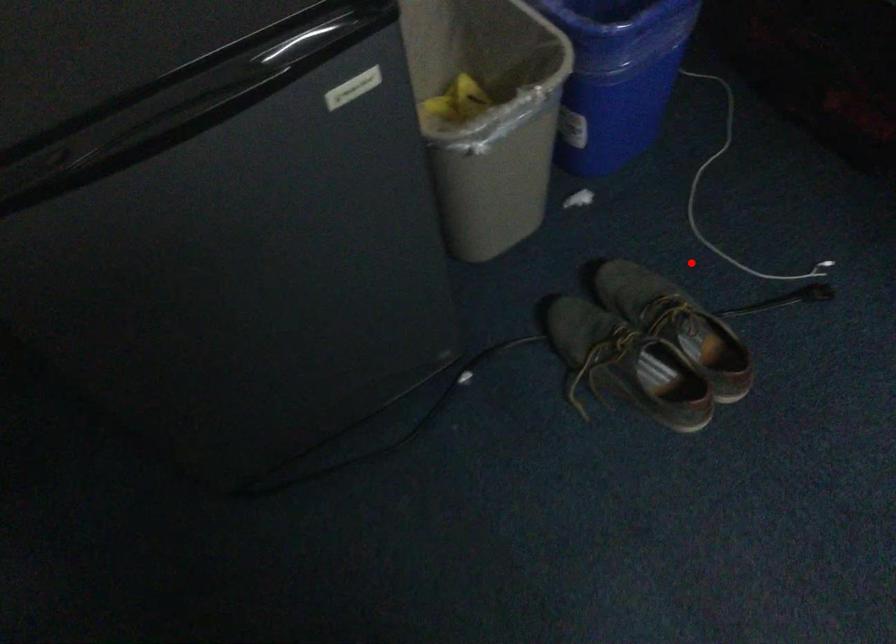
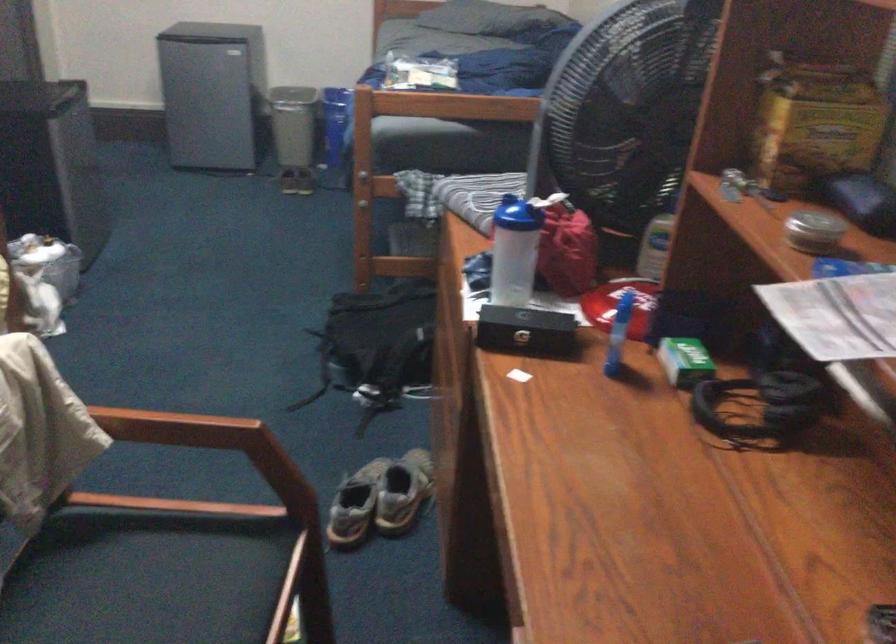
The point at the highlighted location is marked in the first image. Where is the corresponding point in the second image?

(293, 124)